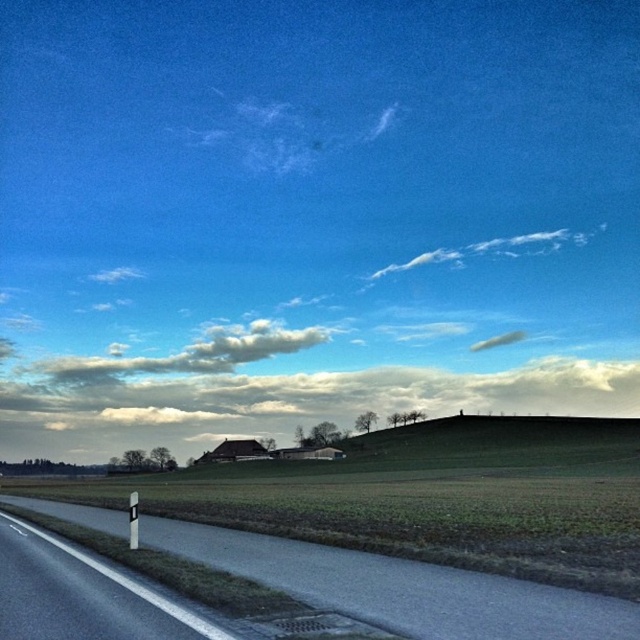
Who is shorter, white glossy signpost at lower left or white fluffy cloud at upper center?

white glossy signpost at lower left

Can you confirm if white glossy signpost at lower left is smaller than white fluffy cloud at upper center?

Yes, white glossy signpost at lower left is smaller than white fluffy cloud at upper center.

You are a GUI agent. You are given a task and a screenshot of the screen. Output one action in this format:
    pyautogui.click(x=<x>, y=<y>)
    Task: Click on the white glossy signpost at lower left
    The height and width of the screenshot is (640, 640).
    Given the screenshot: What is the action you would take?
    pyautogui.click(x=93, y=595)

Between point (483, 600) and point (83, 360), which one is positioned behind?

The point (83, 360) is behind.

Is the position of asphalt road at lower left more distant than that of white fluffy cloud at upper center?

No, it is not.

The width and height of the screenshot is (640, 640). What do you see at coordinates (403, 588) in the screenshot?
I see `asphalt road at lower left` at bounding box center [403, 588].

Where is `asphalt road at lower left`? asphalt road at lower left is located at coordinates click(x=403, y=588).

Can you confirm if asphalt road at lower left is smaller than white glossy signpost at lower left?

Actually, asphalt road at lower left might be larger than white glossy signpost at lower left.

Which is behind, point (320, 589) or point (90, 580)?

Positioned behind is point (90, 580).

Identify the location of asphalt road at lower left. (403, 588).

The width and height of the screenshot is (640, 640). What are the coordinates of `asphalt road at lower left` in the screenshot? It's located at (403, 588).